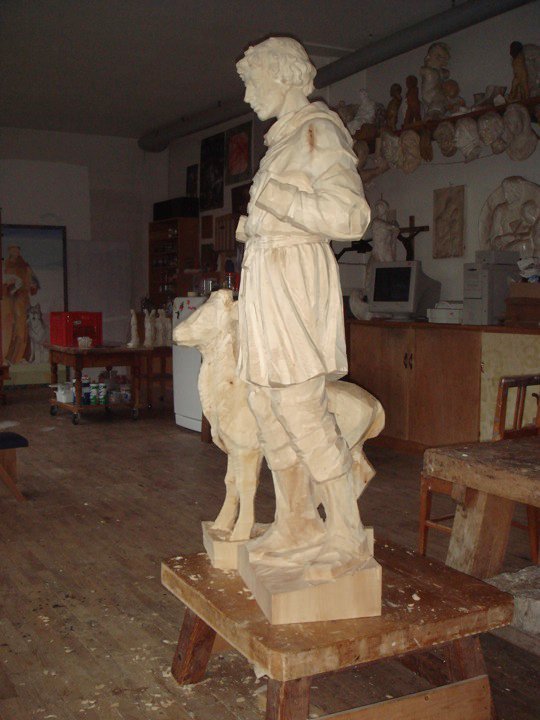
Identify the location of shelf. (474, 114).